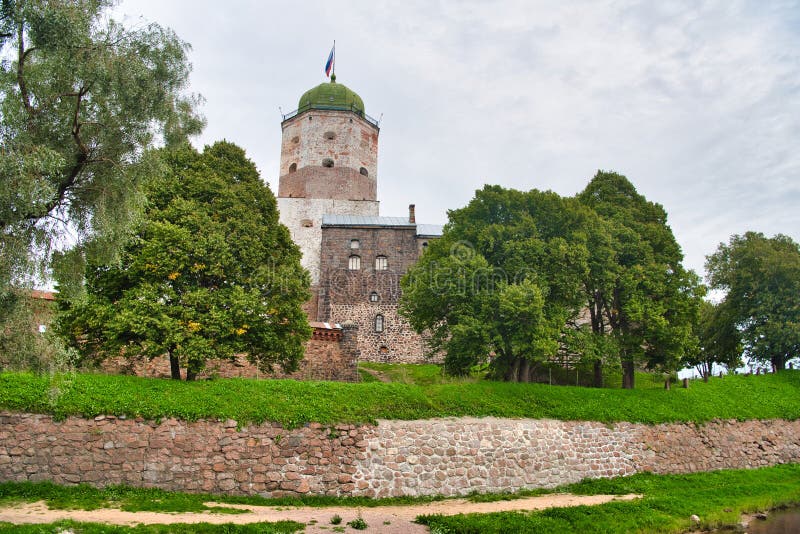
The width and height of the screenshot is (800, 534). I want to click on window, so click(x=384, y=261).